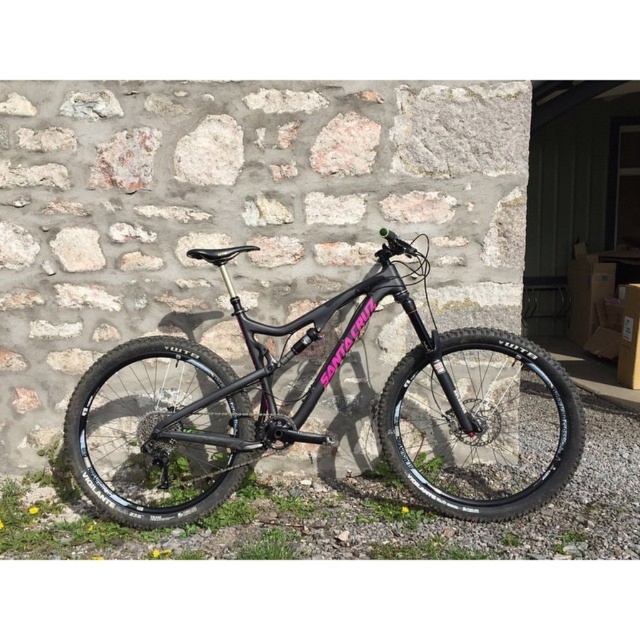
In the scene shown: Which of these two, black rubber tire at lower left or black rubber tire at center, stands shorter?

black rubber tire at lower left is shorter.

Does black rubber tire at lower left appear on the left side of black rubber tire at center?

Correct, you'll find black rubber tire at lower left to the left of black rubber tire at center.

In order to click on black rubber tire at lower left in this screenshot , I will do `click(148, 435)`.

This screenshot has width=640, height=640. I want to click on black rubber tire at lower left, so (148, 435).

Consider the image. Between matte black mountain bike at center and black rubber tire at center, which one has more height?

matte black mountain bike at center

Is matte black mountain bike at center positioned at the back of black rubber tire at center?

Yes, matte black mountain bike at center is further from the viewer.

At what (x,y) coordinates should I click in order to perform the action: click on matte black mountain bike at center. Please return your answer as a coordinate pair (x, y). This screenshot has width=640, height=640. Looking at the image, I should click on (296, 408).

Does point (380, 410) come behind point (211, 419)?

No, it is not.

Does matte black mountain bike at center have a lesser height compared to black rubber tire at lower left?

No.

Does point (163, 500) come in front of point (97, 396)?

Yes, point (163, 500) is closer to viewer.

The width and height of the screenshot is (640, 640). In order to click on matte black mountain bike at center in this screenshot , I will do `click(296, 408)`.